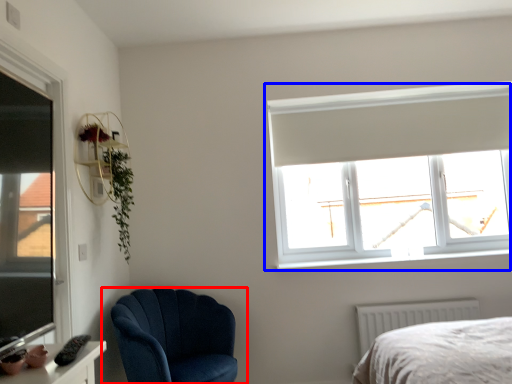
Question: Which object appears closest to the camera in this image, chair (highlighted by a red box) or window (highlighted by a blue box)?

Choices:
 (A) chair
 (B) window

Answer: (A)